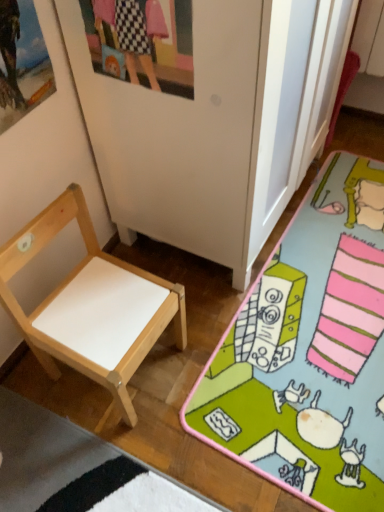
The image size is (384, 512). Find the location of `free point below white matte desk at lower left (from a real-world perspective)`. free point below white matte desk at lower left (from a real-world perspective) is located at coordinates (315, 351).